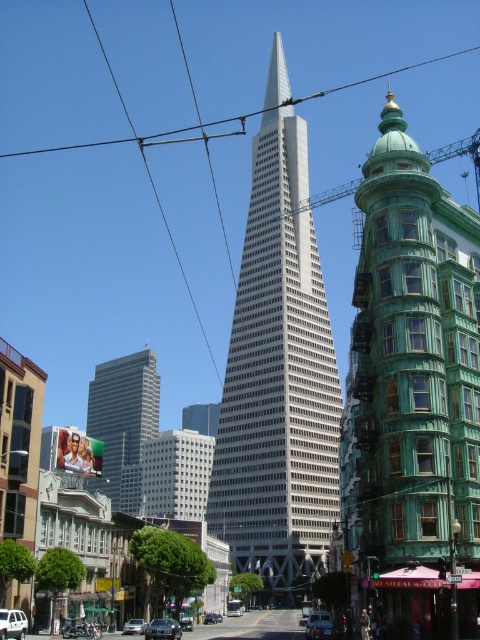
You are a delivery driver approaching the intersection where the green glass skyscraper at center and the white matte suv at center are visible. Which object would you see first as you drive towards them?

The green glass skyscraper at center is located below the white matte suv at center, so you would see the white matte suv at center first as it is positioned higher up.

You are a city planner analyzing the urban layout. You notice a point marked at coordinates (319, 625) in the image. What does this point indicate?

The point at coordinates (319, 625) marks the location of the silver metallic car at center.